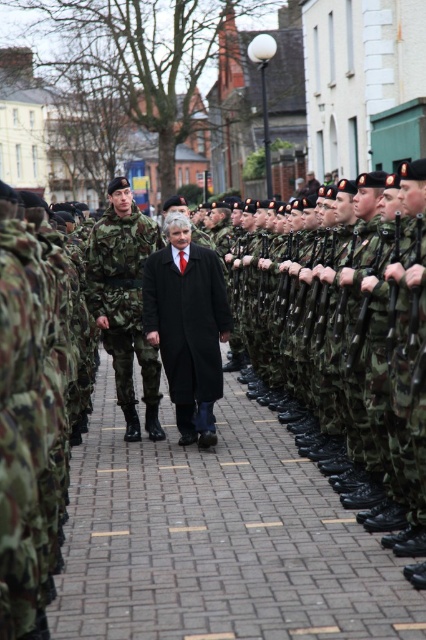
Question: Among these objects, which one is nearest to the camera?

Choices:
 (A) brick pavement at center
 (B) camouflage uniform at center
 (C) black wool coat at center

Answer: (A)

Question: Is camouflage uniform at center further to camera compared to black wool coat at center?

Choices:
 (A) no
 (B) yes

Answer: (B)

Question: Which object is the closest to the camouflage uniform at center?

Choices:
 (A) black wool coat at center
 (B) brick pavement at center

Answer: (A)

Question: Which of the following is the farthest from the observer?

Choices:
 (A) (77, 512)
 (B) (206, 294)

Answer: (B)

Question: Does brick pavement at center appear on the right side of black wool coat at center?

Choices:
 (A) no
 (B) yes

Answer: (B)

Question: Can you confirm if camouflage uniform at center is thinner than black wool coat at center?

Choices:
 (A) yes
 (B) no

Answer: (A)